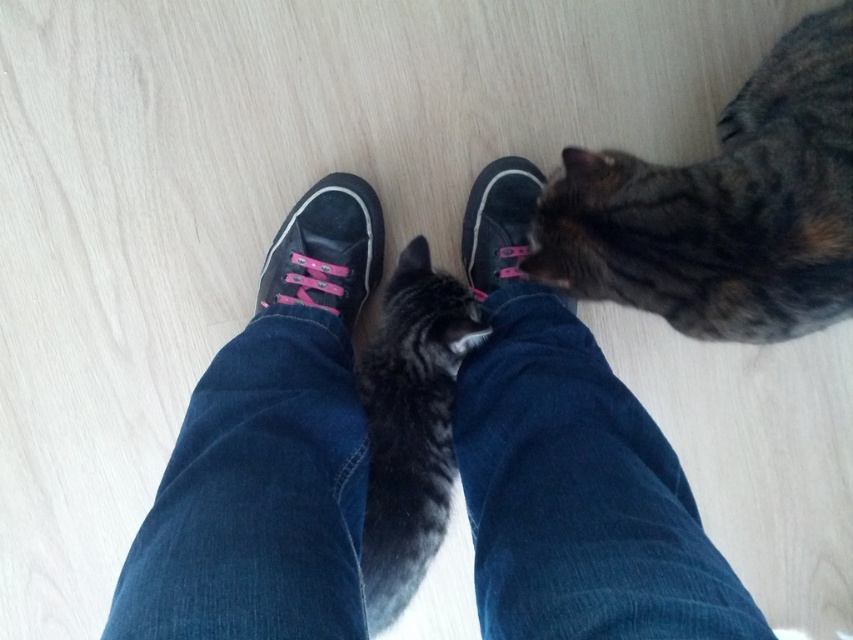
Question: Observing the image, what is the correct spatial positioning of gray striped fur at center in reference to suede/black shoe at center?

Choices:
 (A) above
 (B) below

Answer: (B)

Question: Which of the following is the closest to the observer?

Choices:
 (A) (358, 468)
 (B) (625, 179)

Answer: (A)

Question: Is denim pants at center behind tabby fur cat at lower right?

Choices:
 (A) no
 (B) yes

Answer: (A)

Question: Among these points, which one is farthest from the camera?

Choices:
 (A) (577, 364)
 (B) (399, 451)
 (C) (292, 288)
 (D) (723, 182)

Answer: (C)

Question: Which of the following is the farthest from the observer?

Choices:
 (A) black canvas shoe at center
 (B) suede/black shoe at center

Answer: (A)

Question: Can you confirm if gray striped fur at center is positioned to the right of suede/black shoe at center?

Choices:
 (A) no
 (B) yes

Answer: (B)